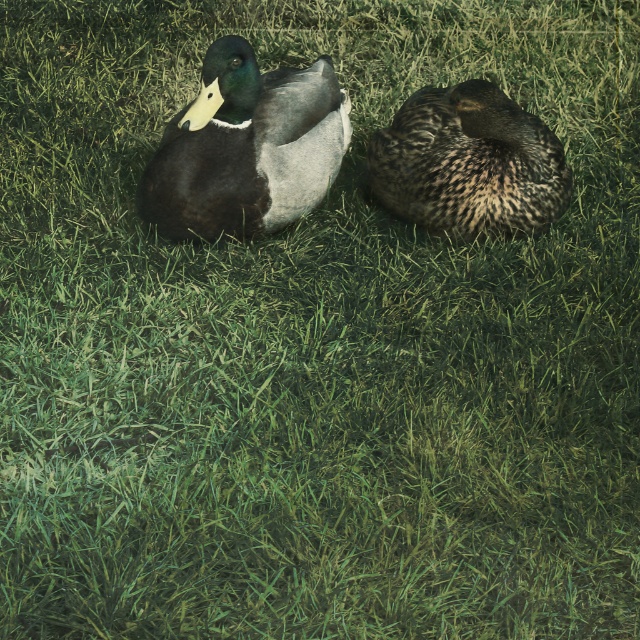
From the picture: You are standing at the point labeled point [214,56] and want to throw a small pebble to hit the duck on the left. The duck on the left is 1.2 meters away from you. Can you accurately throw the pebble to hit the duck on the left from your current position?

Yes, you can accurately throw the pebble to hit the duck on the left from your current position at point [214,56] because the duck on the left is only 1.2 meters away, which is within a manageable throwing distance.

You are standing at the origin point of the image. There is a shiny green duck at upper left and another object at point (246, 147). Which direction should you move to reach the shiny green duck at upper left?

The point (246, 147) corresponds to the shiny green duck at upper left, so you should move towards that coordinate to reach it.

You are a birdwatcher observing the ducks. You notice the shiny green duck at upper left and the speckled feathered duck at right. Which duck is positioned higher in the image?

The shiny green duck at upper left is positioned higher in the image than the speckled feathered duck at right.